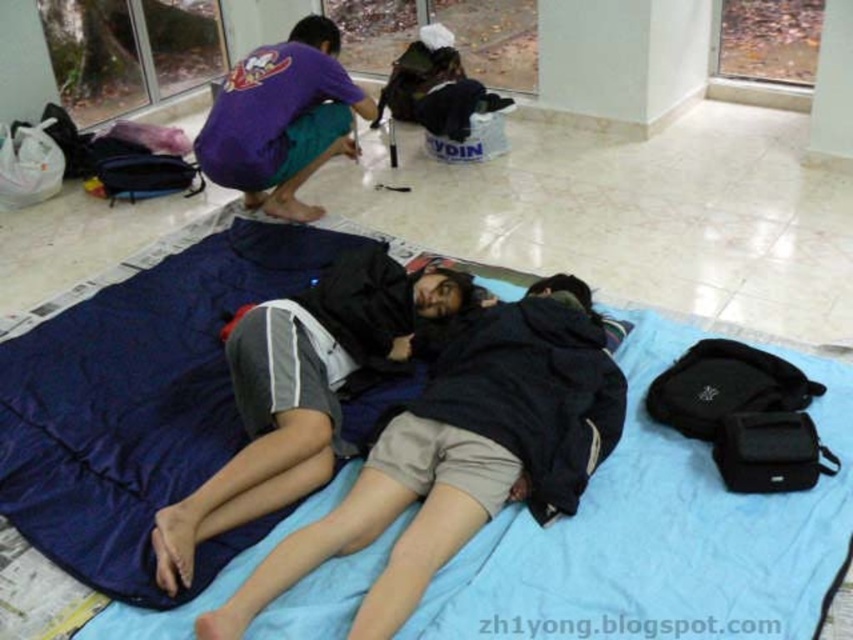
You are standing at the point labeled as point (305,150) in the image. You want to walk towards the point labeled as point (262,582). Which direction should you face to walk directly towards it?

You should face forward because point (262,582) is in front of point (305,150).